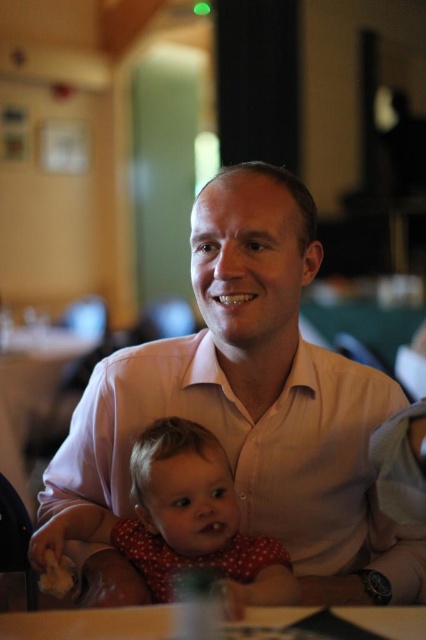
You are a photographer trying to capture a closeup of the pink smooth shirt at center and the polka dot fabric baby at center. Since the background is blurred, which object should you focus on to ensure both are in focus?

To ensure both the pink smooth shirt at center and the polka dot fabric baby at center are in focus, focus on the pink smooth shirt at center since it is positioned to the right of the baby, which means it is farther away from the camera. This way, the depth of field will cover both subjects.

You are a photographer trying to capture a closeup of the pink smooth shirt at center and the polka dot fabric baby at center. Since the camera can only focus on one subject at a time, which one should you choose to ensure the other remains in the background?

The pink smooth shirt at center is bigger than the polka dot fabric baby at center, so you should focus on the pink smooth shirt at center to keep the smaller baby in the background.

You are a photographer trying to capture the baby in the center of the image. The camera you are using has a focus point at coordinate point [180,522]. Does this focus point align with the baby?

Yes, the focus point at coordinate point [180,522] aligns with the baby since the point indicates the polka dot fabric baby at center.